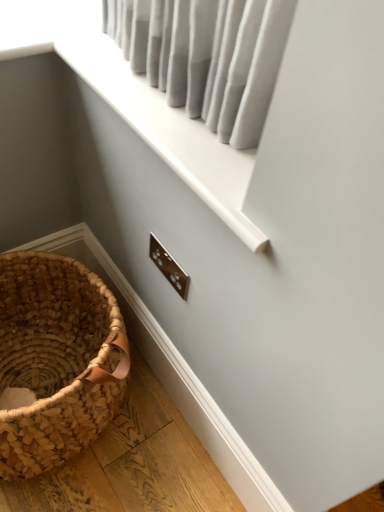
Question: Considering the relative sizes of brown woven picnic basket at lower left and white plastic window frame at upper center in the image provided, is brown woven picnic basket at lower left taller than white plastic window frame at upper center?

Choices:
 (A) no
 (B) yes

Answer: (B)

Question: Does brown woven picnic basket at lower left have a greater width compared to white plastic window frame at upper center?

Choices:
 (A) yes
 (B) no

Answer: (A)

Question: Can you confirm if brown woven picnic basket at lower left is positioned to the left of white plastic window frame at upper center?

Choices:
 (A) yes
 (B) no

Answer: (A)

Question: Does brown woven picnic basket at lower left have a smaller size compared to white plastic window frame at upper center?

Choices:
 (A) no
 (B) yes

Answer: (A)

Question: Is brown woven picnic basket at lower left turned away from white plastic window frame at upper center?

Choices:
 (A) yes
 (B) no

Answer: (B)

Question: Considering the relative sizes of brown woven picnic basket at lower left and white plastic window frame at upper center in the image provided, is brown woven picnic basket at lower left bigger than white plastic window frame at upper center?

Choices:
 (A) no
 (B) yes

Answer: (B)

Question: Is the surface of white plastic window frame at upper center in direct contact with brown woven picnic basket at lower left?

Choices:
 (A) no
 (B) yes

Answer: (A)

Question: Does white plastic window frame at upper center have a smaller size compared to brown woven picnic basket at lower left?

Choices:
 (A) no
 (B) yes

Answer: (B)

Question: From the image's perspective, does white plastic window frame at upper center appear lower than brown woven picnic basket at lower left?

Choices:
 (A) yes
 (B) no

Answer: (B)

Question: Can you confirm if white plastic window frame at upper center is positioned to the left of brown woven picnic basket at lower left?

Choices:
 (A) no
 (B) yes

Answer: (A)

Question: Could brown woven picnic basket at lower left be considered to be inside white plastic window frame at upper center?

Choices:
 (A) yes
 (B) no

Answer: (B)

Question: Considering the relative sizes of white plastic window frame at upper center and brown woven picnic basket at lower left in the image provided, is white plastic window frame at upper center shorter than brown woven picnic basket at lower left?

Choices:
 (A) yes
 (B) no

Answer: (A)

Question: From the image's perspective, is brown woven picnic basket at lower left positioned above or below white plastic window frame at upper center?

Choices:
 (A) above
 (B) below

Answer: (B)